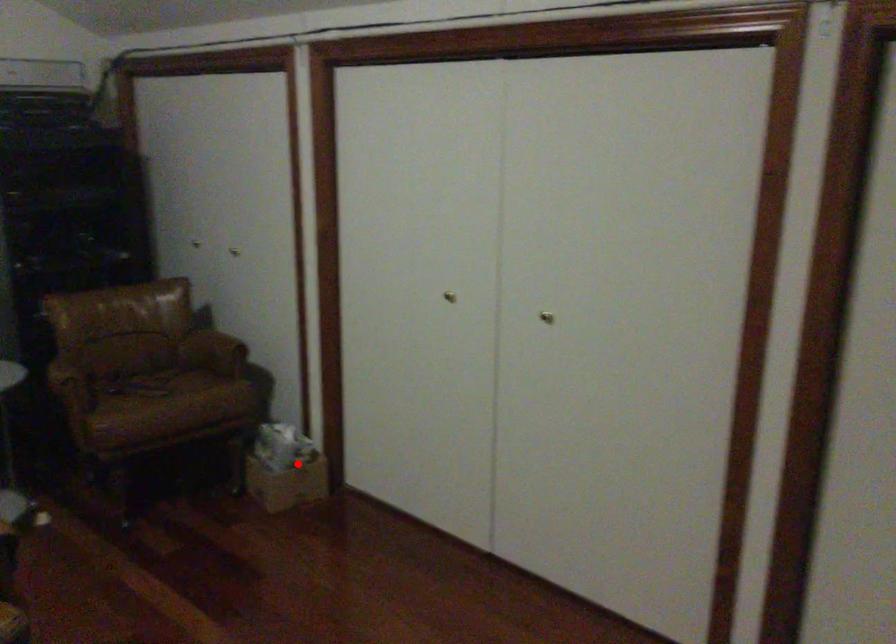
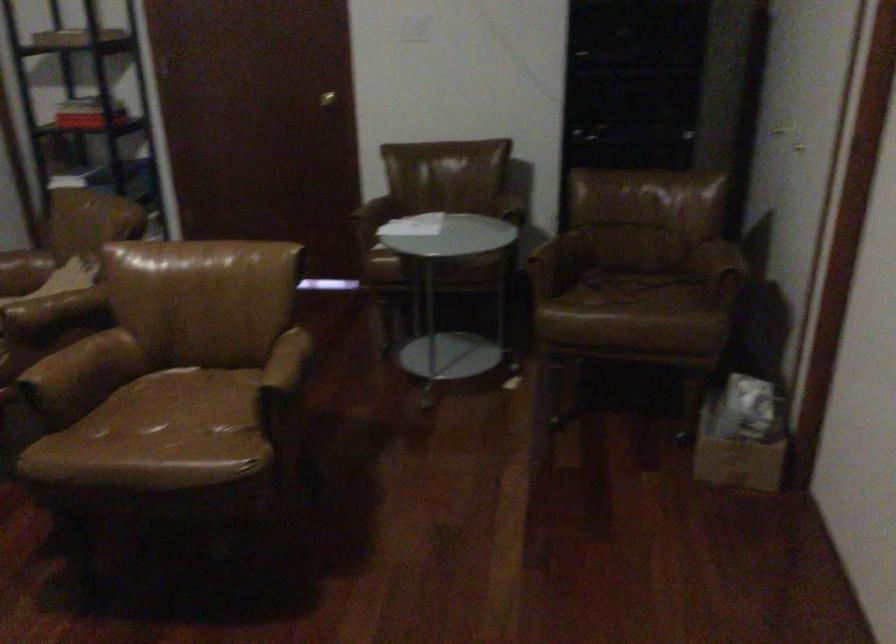
Question: I am providing you with two images of the same scene from different viewpoints. A red point is shown in image1. For the corresponding object point in image2, is it positioned nearer or farther from the camera?

Choices:
 (A) Nearer
 (B) Farther

Answer: (A)